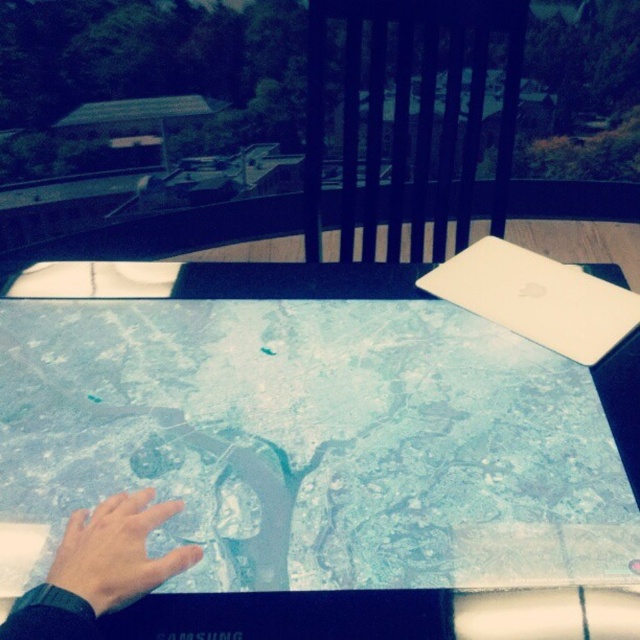
Between transparent glass map at center and matte skin hand at lower left, which one appears on the left side from the viewer's perspective?

matte skin hand at lower left

Image resolution: width=640 pixels, height=640 pixels. What do you see at coordinates (310, 440) in the screenshot?
I see `transparent glass map at center` at bounding box center [310, 440].

Is point (36, 432) less distant than point (147, 561)?

No, (36, 432) is further to viewer.

Locate an element on the screen. The width and height of the screenshot is (640, 640). transparent glass map at center is located at coordinates (310, 440).

Between transparent glass map at center and white matte laptop at upper right, which one is positioned lower?

transparent glass map at center is lower down.

Can you confirm if transparent glass map at center is positioned to the left of white matte laptop at upper right?

Yes, transparent glass map at center is to the left of white matte laptop at upper right.

Which is behind, point (458, 376) or point (436, 296)?

Positioned behind is point (436, 296).

The height and width of the screenshot is (640, 640). Identify the location of transparent glass map at center. (310, 440).

Does point (388, 502) come in front of point (570, 602)?

No, it is not.

Identify the location of transparent glass map at center. Image resolution: width=640 pixels, height=640 pixels. [310, 440].